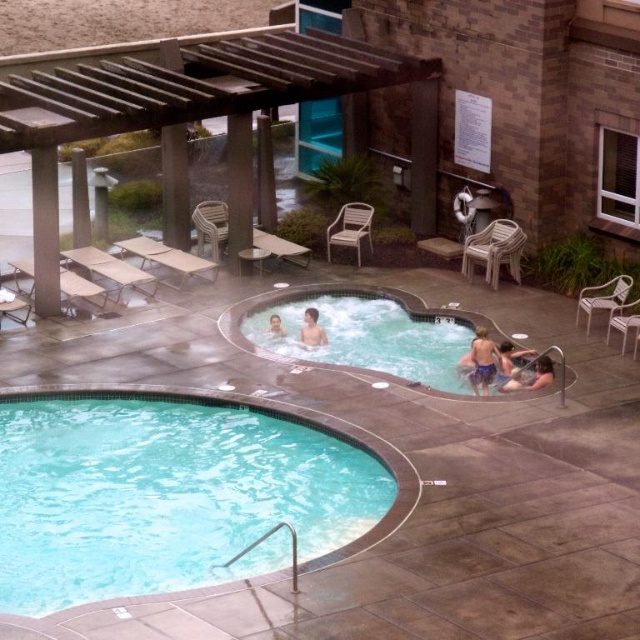
Is wooden chair at center to the right of white plastic chair at right from the viewer's perspective?

In fact, wooden chair at center is to the left of white plastic chair at right.

The width and height of the screenshot is (640, 640). What do you see at coordinates (211, 227) in the screenshot?
I see `wooden chair at center` at bounding box center [211, 227].

Find the location of a particular element. wooden chair at center is located at coordinates (211, 227).

Does clear blue water at lower left come behind smooth blue shorts at lower right?

No, clear blue water at lower left is closer to the viewer.

Which of these two, clear blue water at lower left or smooth blue shorts at lower right, stands shorter?

smooth blue shorts at lower right

Which is behind, point (230, 484) or point (499, 356)?

Point (499, 356)

Locate an element on the screen. Image resolution: width=640 pixels, height=640 pixels. clear blue water at lower left is located at coordinates (164, 496).

Between point (132, 99) and point (272, 316), which one is positioned in front?

Point (132, 99) is in front.

Which is behind, point (413, 64) or point (273, 333)?

Positioned behind is point (413, 64).

Find the location of a particular element. brown wood pergola at upper center is located at coordinates click(192, 113).